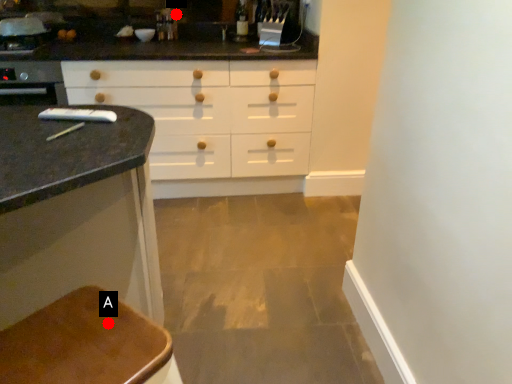
Question: Two points are circled on the image, labeled by A and B beside each circle. Which point appears closest to the camera in this image?

Choices:
 (A) A is closer
 (B) B is closer

Answer: (A)